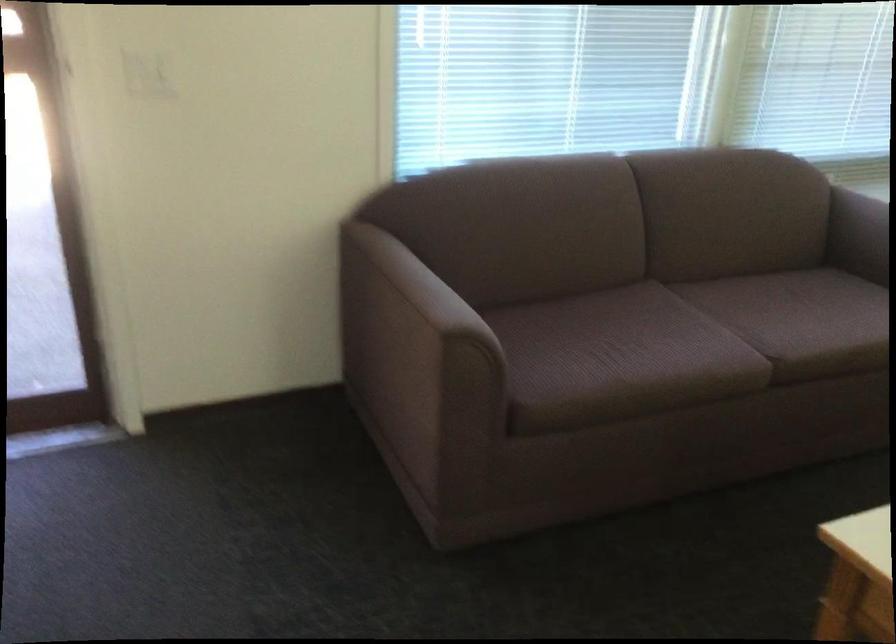
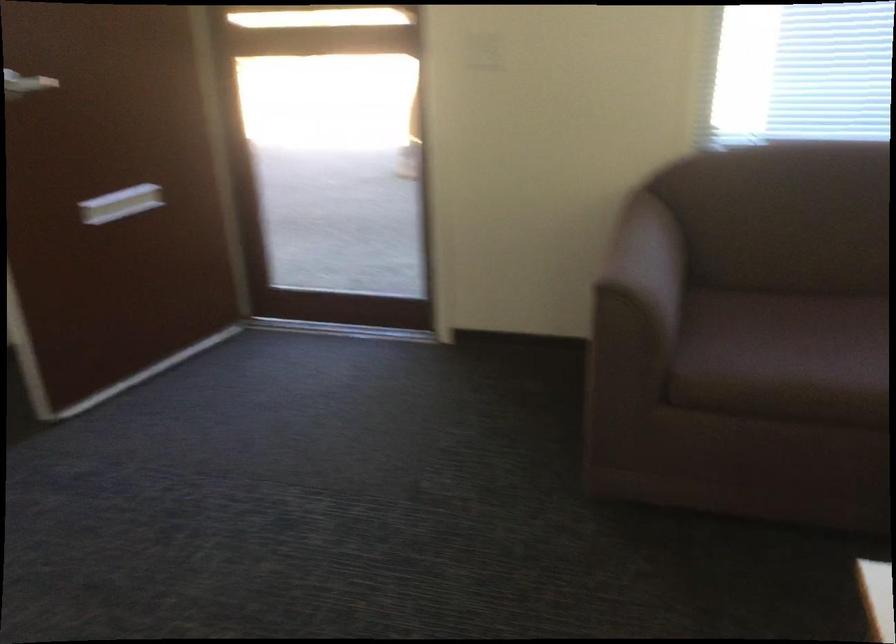
Locate, in the second image, the point that corresponds to pixel 565 346 in the first image.

(786, 337)